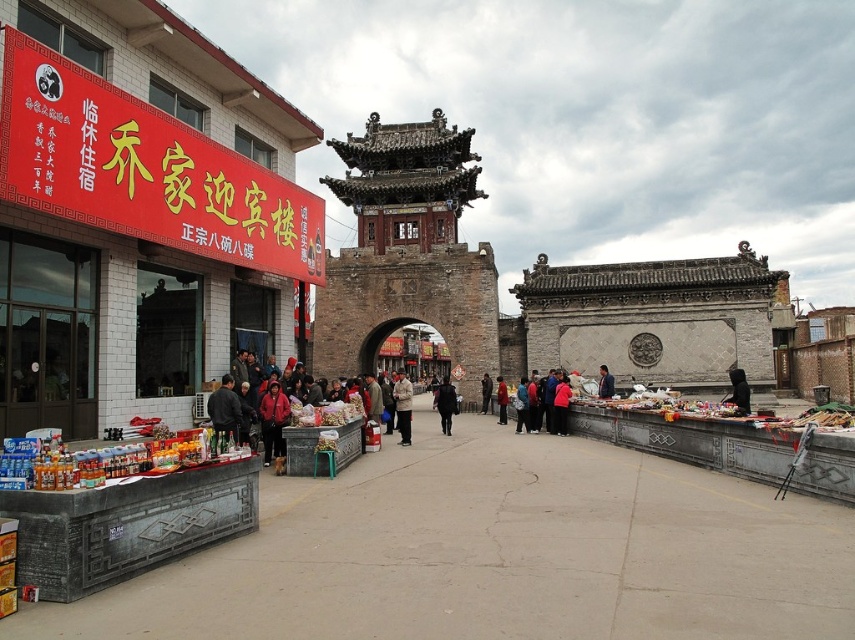
Question: Is white matte jacket at center positioned at the back of red wool coat at center?

Choices:
 (A) yes
 (B) no

Answer: (B)

Question: Which point is closer to the camera?

Choices:
 (A) dark blue suit at center
 (B) black leather jacket at center
 (C) dark gray wool coat at center
 (D) concrete pavement at center

Answer: (D)

Question: Which point appears farthest from the camera in this image?

Choices:
 (A) (506, 509)
 (B) (279, 440)
 (C) (408, 406)

Answer: (C)

Question: Which object is positioned closest to the dark blue suit at center?

Choices:
 (A) red jacket at center
 (B) red wool coat at center
 (C) dark gray jacket at center

Answer: (A)

Question: Is dark gray jacket at center to the left of red wool coat at center from the viewer's perspective?

Choices:
 (A) yes
 (B) no

Answer: (A)

Question: In this image, where is concrete pavement at center located relative to dark gray wool coat at center?

Choices:
 (A) right
 (B) left

Answer: (B)